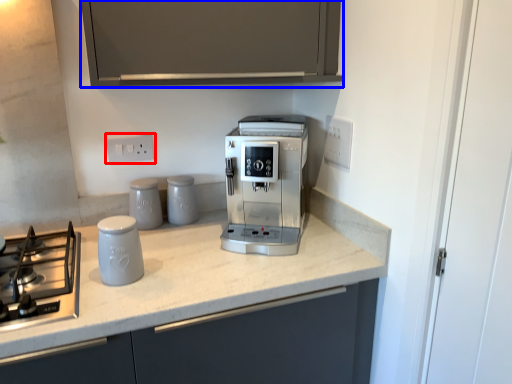
Question: Which object appears closest to the camera in this image, electric outlet (highlighted by a red box) or cabinetry (highlighted by a blue box)?

Choices:
 (A) electric outlet
 (B) cabinetry

Answer: (B)